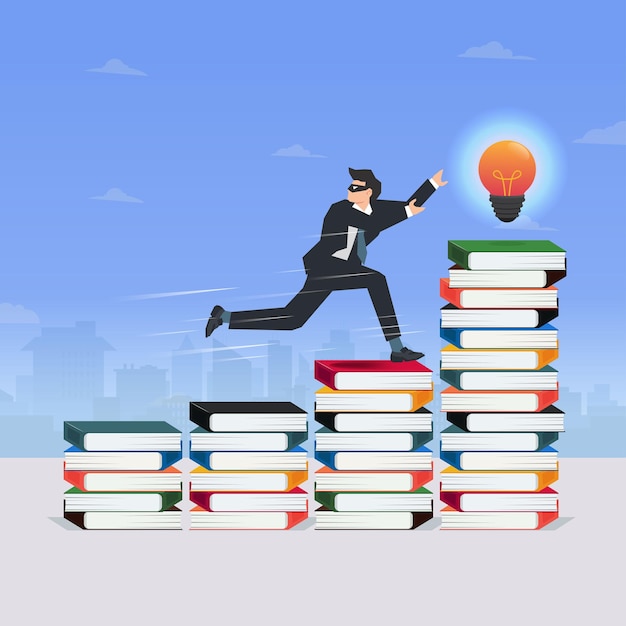
I want to click on light blue books, so click(101, 459), click(359, 462), click(476, 334), click(486, 456).